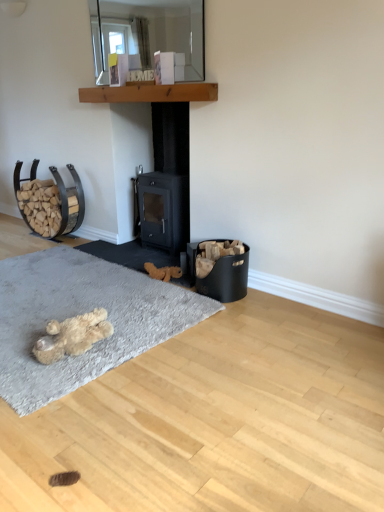
The image size is (384, 512). I want to click on vacant area situated below wooden at upper center (from a real-world perspective), so click(x=143, y=248).